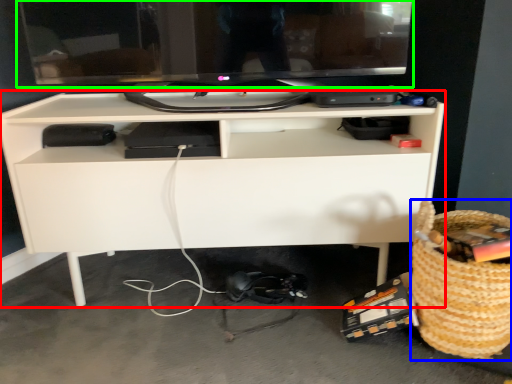
Question: Which object is the farthest from desk (highlighted by a red box)? Choose among these: basket (highlighted by a blue box) or computer monitor (highlighted by a green box).

Choices:
 (A) basket
 (B) computer monitor

Answer: (A)